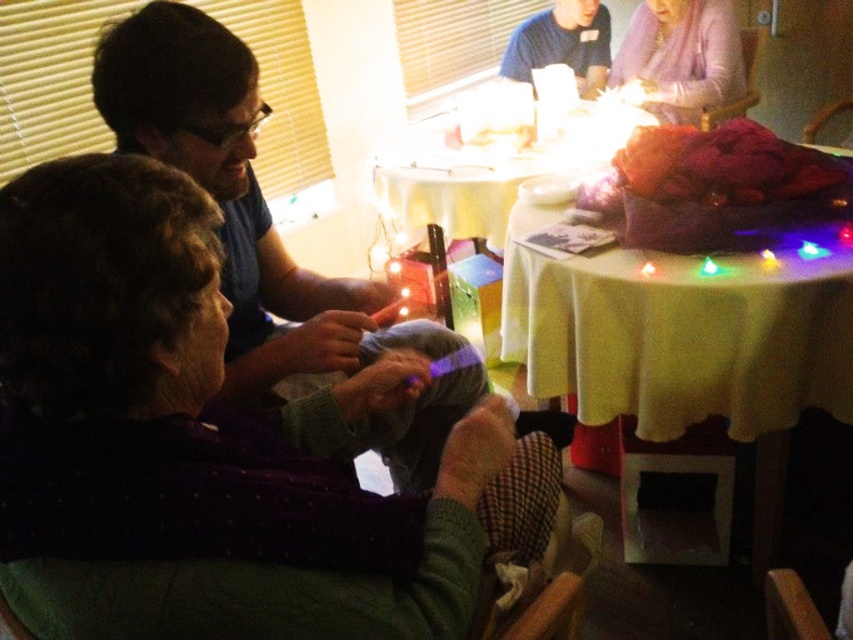
You are planning to place a rectangular gift box that is 1 meter wide on the yellow fabric table at upper center. Considering the size of the matte blue shirt at left, will the gift box fit on the table?

The yellow fabric table at upper center is wider than the matte blue shirt at left. Since the gift box is 1 meter wide, and the table is wider than the shirt, it is likely that the gift box will fit on the yellow fabric table at upper center.

You are a guest at this event and want to sit down at the yellow fabric table at center. Which direction should you move relative to the matte blue shirt at left to reach the table?

You should move to the right relative to the matte blue shirt at left to reach the yellow fabric table at center because the matte blue shirt at left is to the left of the yellow fabric table at center.